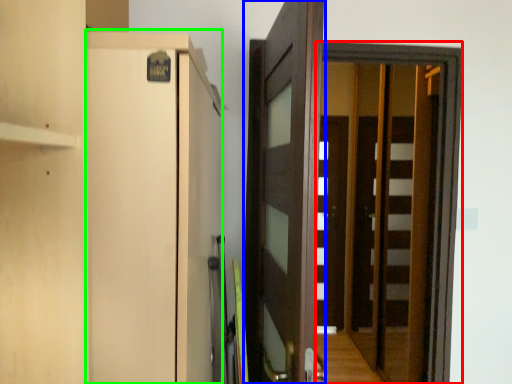
Question: Which is farther away from screen door (highlighted by a red box)? door (highlighted by a blue box) or cabinetry (highlighted by a green box)?

Choices:
 (A) door
 (B) cabinetry

Answer: (B)